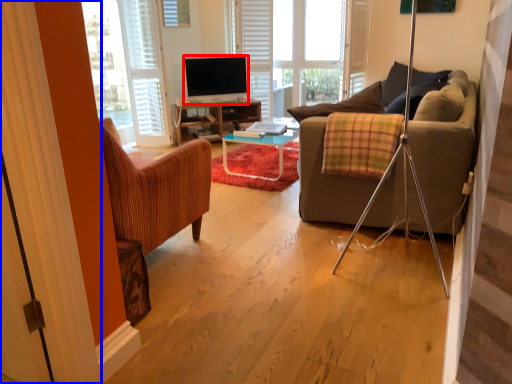
Question: Among these objects, which one is nearest to the camera, television (highlighted by a red box) or curtain (highlighted by a blue box)?

Choices:
 (A) television
 (B) curtain

Answer: (B)